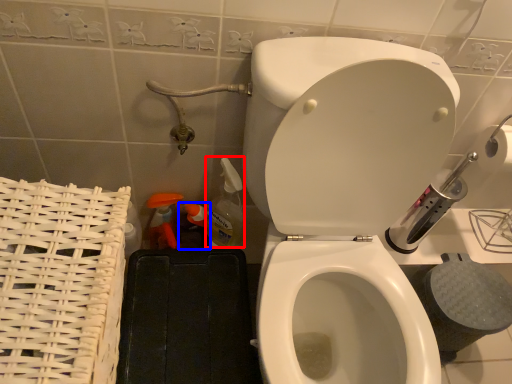
Question: Which object appears farthest to the camera in this image, cleaning product (highlighted by a red box) or cleaning product (highlighted by a blue box)?

Choices:
 (A) cleaning product
 (B) cleaning product

Answer: (B)